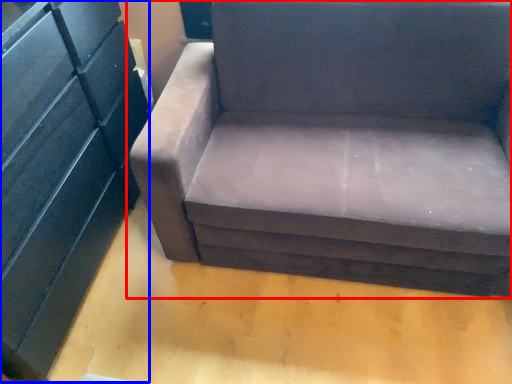
Question: Among these objects, which one is farthest to the camera, studio couch (highlighted by a red box) or dresser (highlighted by a blue box)?

Choices:
 (A) studio couch
 (B) dresser

Answer: (A)